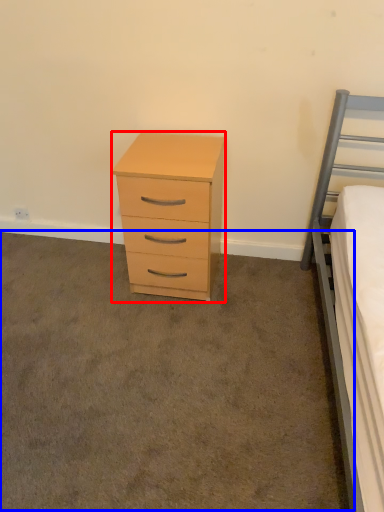
Question: Which of the following is the farthest to the observer, chest of drawers (highlighted by a red box) or plain (highlighted by a blue box)?

Choices:
 (A) chest of drawers
 (B) plain

Answer: (A)